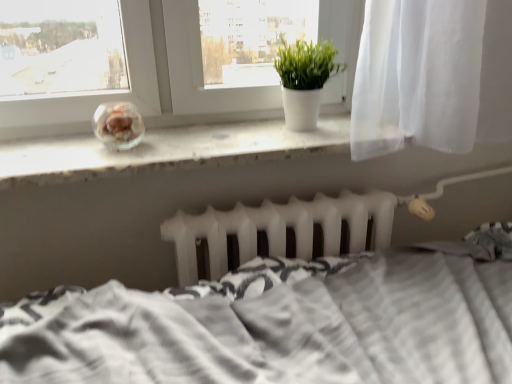
The image size is (512, 384). Identify the location of free space above white matte window sill at center (from a real-world perspective). (189, 138).